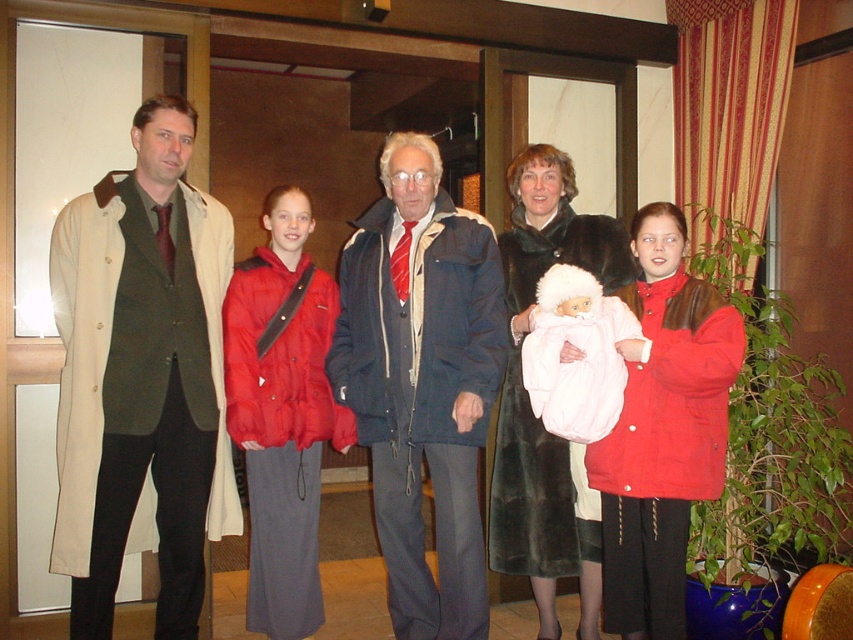
Question: Among these objects, which one is farthest from the camera?

Choices:
 (A) velvet black coat at center
 (B) soft pink fabric baby at center
 (C) matte black coat at center
 (D) dark blue textured jacket at center

Answer: (A)

Question: Does matte black coat at center lie behind matte pink fabric baby at center?

Choices:
 (A) yes
 (B) no

Answer: (B)

Question: Does matte beige coat at left appear over velvet black coat at center?

Choices:
 (A) no
 (B) yes

Answer: (B)

Question: Based on their relative distances, which object is nearer to the soft pink fabric baby at center?

Choices:
 (A) matte pink fabric baby at center
 (B) velvet black coat at center
 (C) matte beige coat at left

Answer: (B)

Question: Which point is closer to the camera?

Choices:
 (A) matte black coat at center
 (B) dark blue textured jacket at center
 (C) soft pink fabric baby at center

Answer: (A)

Question: Can you confirm if dark blue textured jacket at center is thinner than matte red coat at right?

Choices:
 (A) yes
 (B) no

Answer: (B)